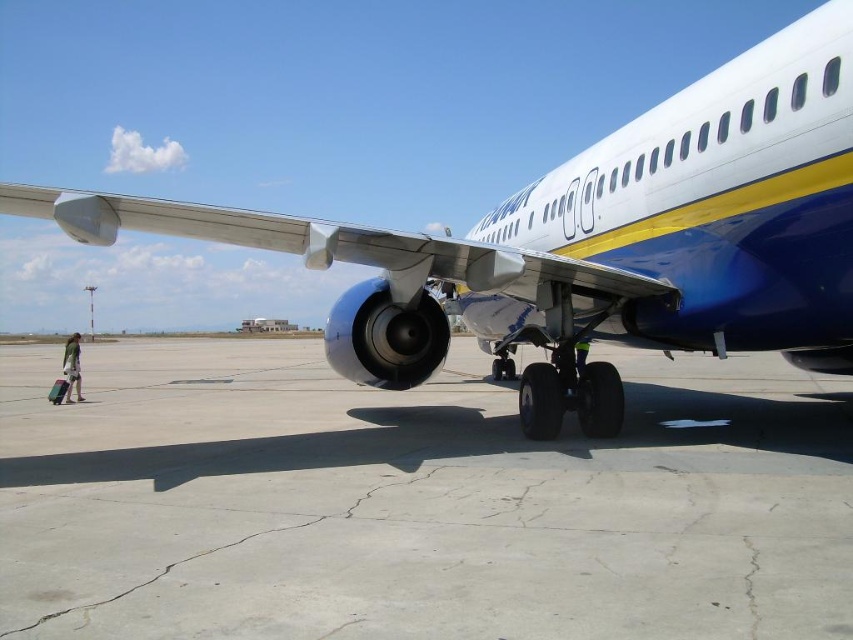
Which is in front, point (137, 438) or point (828, 225)?

Point (828, 225)

Does point (25, 506) lie behind point (831, 99)?

That is False.

At what (x,y) coordinates should I click in order to perform the action: click on gray concrete tarmac at center. Please return your answer as a coordinate pair (x, y). Looking at the image, I should click on (416, 502).